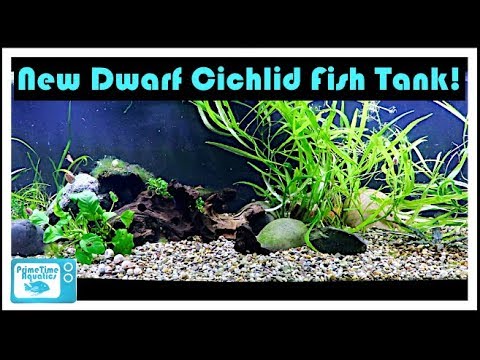
Find the location of `decorations`. decorations is located at coordinates (150, 209), (118, 178), (363, 200), (23, 235).